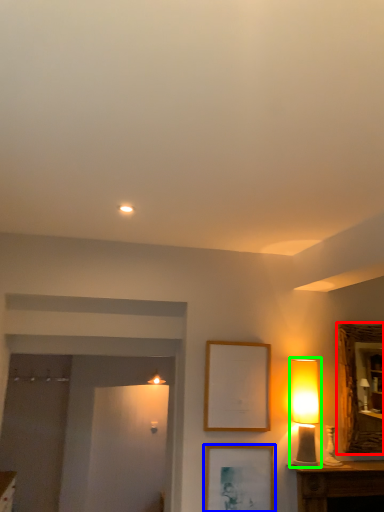
Question: Estimate the real-world distances between objects in this image. Which object is closer to mirror (highlighted by a red box), picture frame (highlighted by a blue box) or table lamp (highlighted by a green box)?

Choices:
 (A) picture frame
 (B) table lamp

Answer: (B)